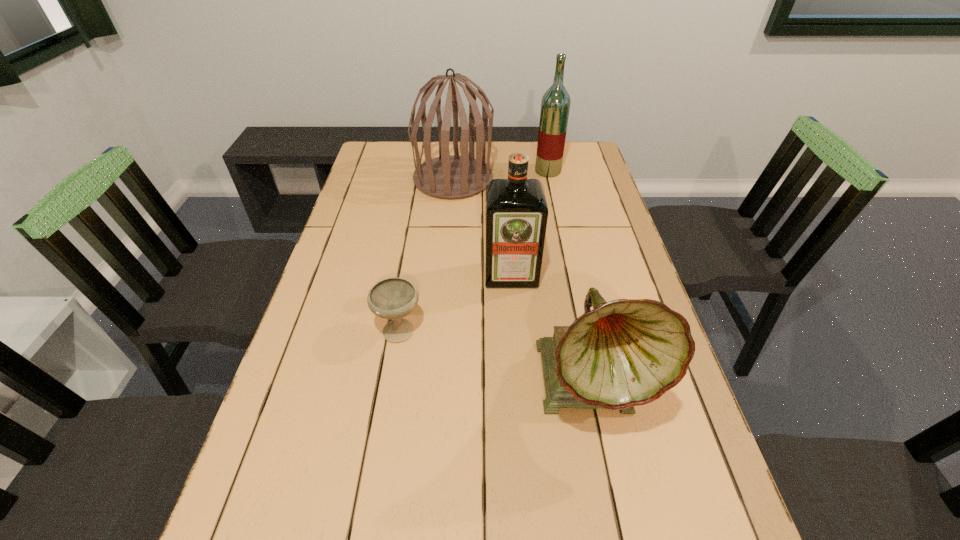
This screenshot has height=540, width=960. I want to click on vacant area that lies between the shortest object and the third farthest object, so click(x=455, y=302).

You are a GUI agent. You are given a task and a screenshot of the screen. Output one action in this format:
    pyautogui.click(x=<x>, y=<y>)
    Task: Click on the unoccupied area between the record player and the shortest object
    Image resolution: width=960 pixels, height=540 pixels.
    Given the screenshot: What is the action you would take?
    pyautogui.click(x=493, y=356)

This screenshot has height=540, width=960. What are the coordinates of `free space that is in between the chalice and the third nearest object` in the screenshot? It's located at (455, 302).

The width and height of the screenshot is (960, 540). Identify the location of free space that is in between the farther liquor and the record player. (568, 278).

At what (x,y) coordinates should I click in order to perform the action: click on free space between the left liquor and the record player. Please return your answer as a coordinate pair (x, y). The width and height of the screenshot is (960, 540). Looking at the image, I should click on (550, 329).

Locate an element on the screen. This screenshot has height=540, width=960. vacant area between the left liquor and the shortest object is located at coordinates (455, 302).

Identify the location of empty space between the birdcage and the right liquor. (500, 175).

Select which object appears as the third closest to the left liquor. Please provide its 2D coordinates. Your answer should be formatted as a tuple, i.e. [(x, y)], where the tuple contains the x and y coordinates of a point satisfying the conditions above.

[(448, 176)]

In order to click on the closest object to the nearer liquor in this screenshot , I will do `click(628, 352)`.